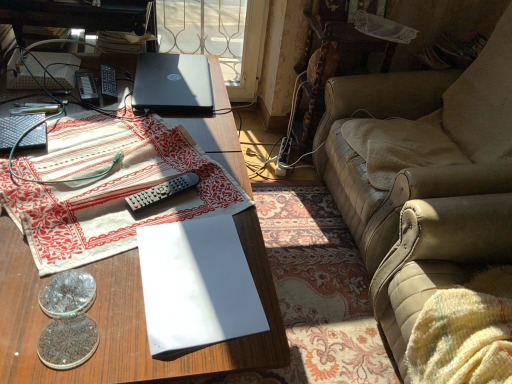
You are a GUI agent. You are given a task and a screenshot of the screen. Output one action in this format:
    pyautogui.click(x=<x>, y=<y>)
    Task: Click on the vacant space in front of white paper at left, arranged as the 2th paperback book when viewed from the front
    This screenshot has height=384, width=512.
    Given the screenshot: What is the action you would take?
    pyautogui.click(x=33, y=102)